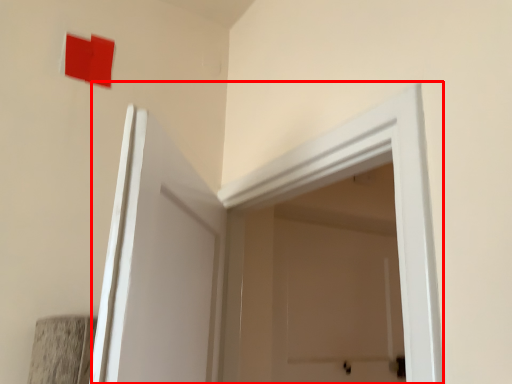
Question: Observing the image, what is the correct spatial positioning of door (annotated by the red box) in reference to square?

Choices:
 (A) right
 (B) left

Answer: (A)